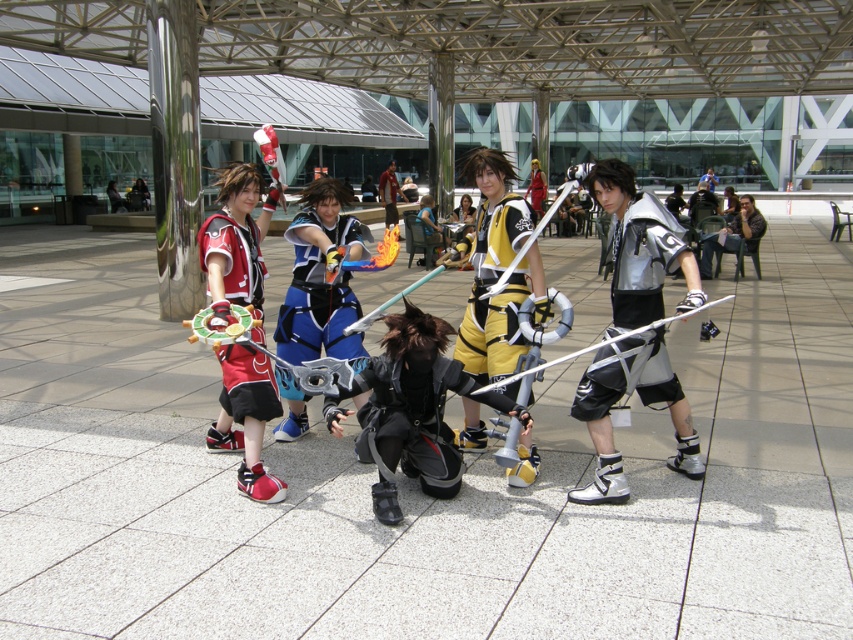
You are organizing a photo shoot and need to place two cosplayers wearing the silver metallic armor at center and the black matte armor at center side by side. Given their armor widths, which cosplayer should you position first to ensure they fit within the 1.2 meter wide space allocated for them?

Since the silver metallic armor at center is narrower than the black matte armor at center, you should position the cosplayer in the silver metallic armor at center first to ensure both fit within the 1.2 meter space.